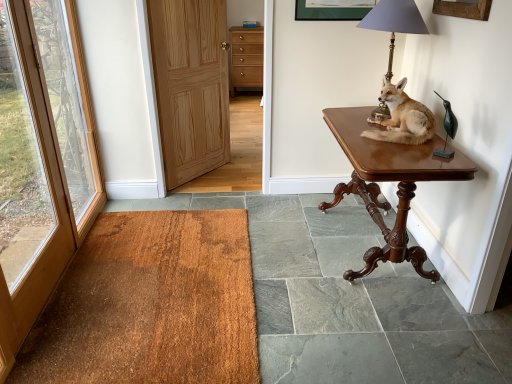
Locate an element on the screen. The image size is (512, 384). vacant space situated above brown wood table at right (from a real-world perspective) is located at coordinates (379, 134).